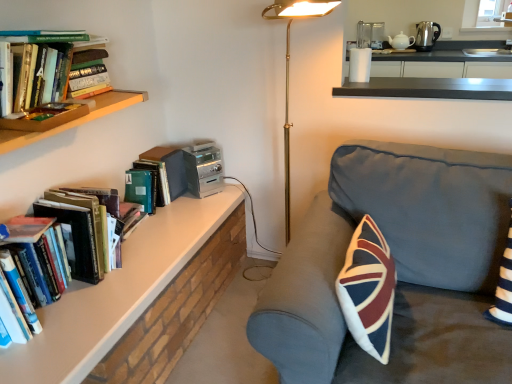
At what (x,y) coordinates should I click in order to perform the action: click on free location to the right of hardcover book at upper left, the 1th book viewed from the back. Please return your answer as a coordinate pair (x, y). Looking at the image, I should click on (196, 208).